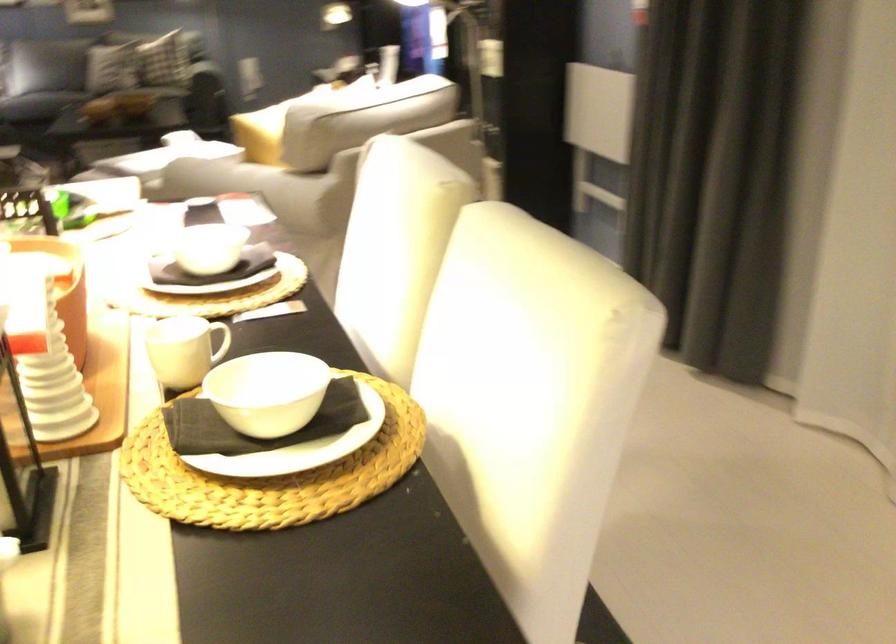
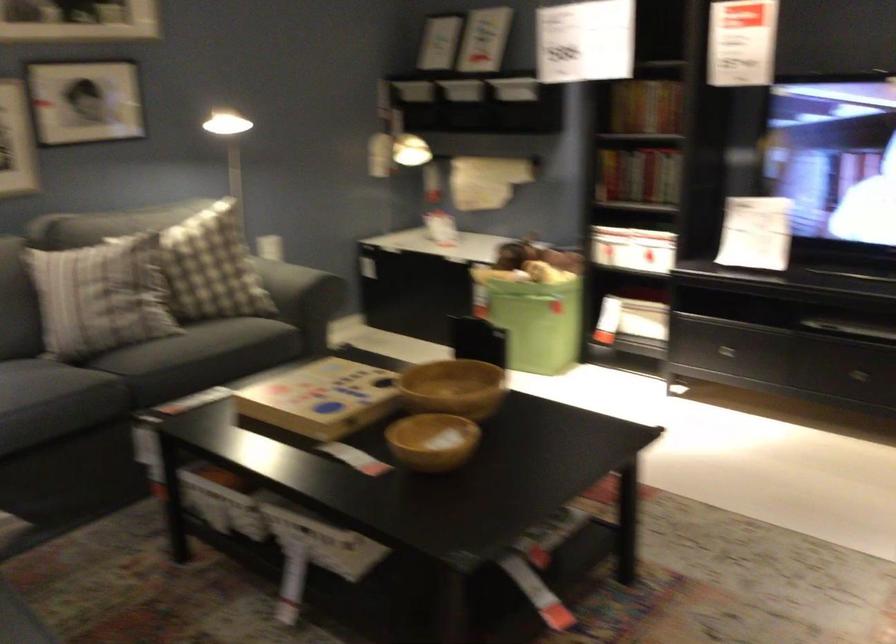
Locate, in the second image, the point that corresponds to pixel 108 79 in the first image.

(199, 357)